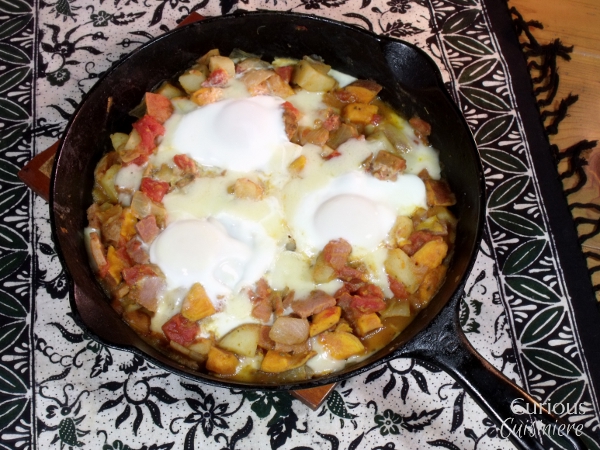
Where is `placemat`? Image resolution: width=600 pixels, height=450 pixels. placemat is located at coordinates (76, 398), (514, 202).